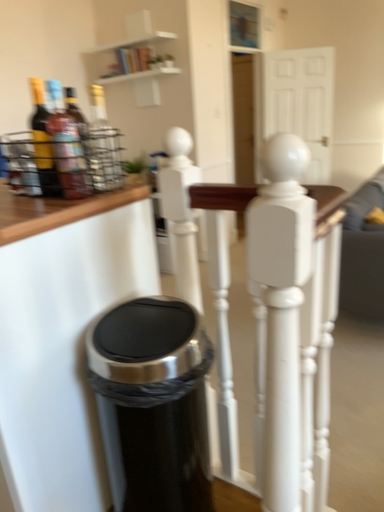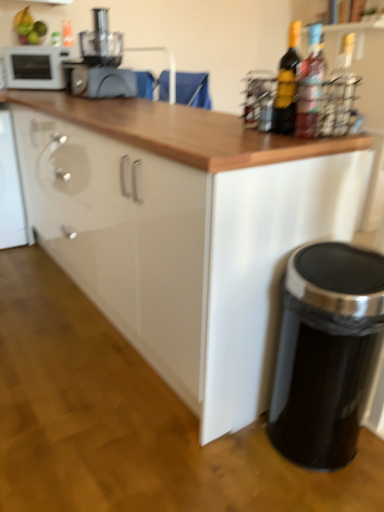
Question: Which way did the camera rotate in the video?

Choices:
 (A) rotated right
 (B) rotated left

Answer: (B)